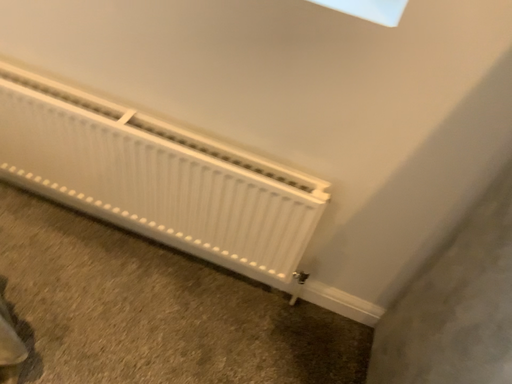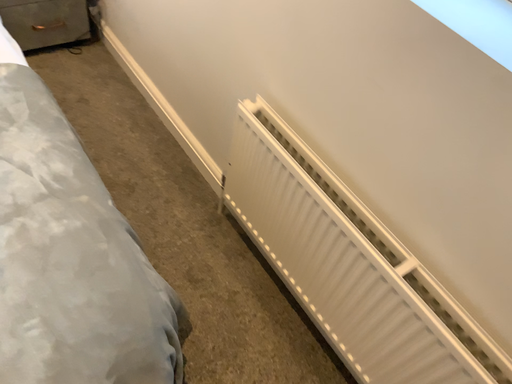
Question: Which way did the camera rotate in the video?

Choices:
 (A) rotated upward
 (B) rotated downward

Answer: (A)